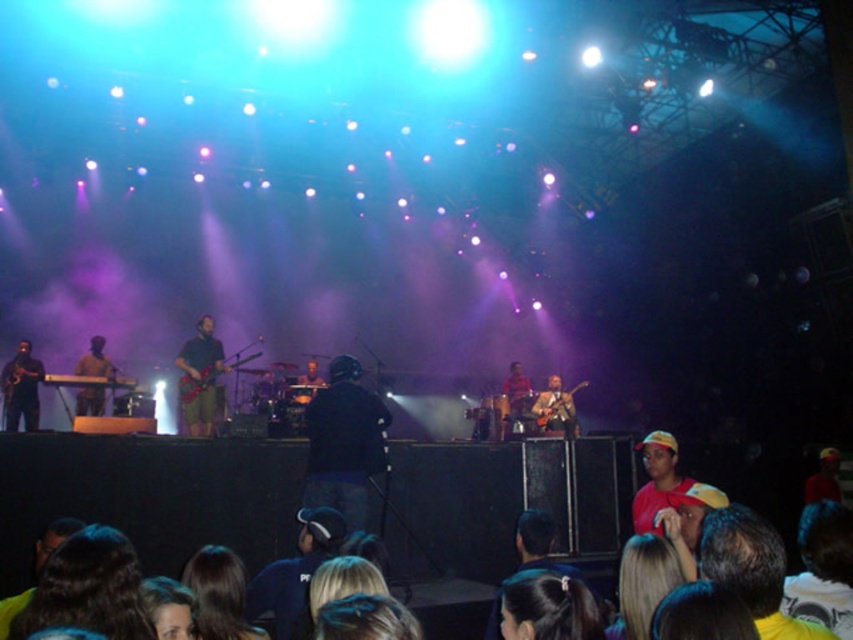
You are a photographer at the concert and want to capture the wooden acoustic guitar at center. You are currently standing at point (554, 408). Is the guitar in front of you or behind you?

The wooden acoustic guitar at center is located at point (554, 408), which is where you are standing. Therefore, the guitar is neither in front nor behind you since you are at the same position.

You are a photographer at the concert and want to capture both the point at (x=544, y=401) and the point at (x=201, y=381) in your photo. Which point is closer to the camera?

Point (x=201, y=381) is closer to the camera than point (x=544, y=401) because the description states that point (x=544, y=401) is further away.

You are a photographer at the concert and want to capture both the wooden acoustic guitar at center and the metallic guitar at center in a single shot. Since you can only focus on one guitar at a time, which one should you focus on to ensure the other remains in the background?

You should focus on the metallic guitar at center because the wooden acoustic guitar at center is to the right of it, so adjusting focus to the metallic guitar will keep the wooden acoustic guitar in the background.